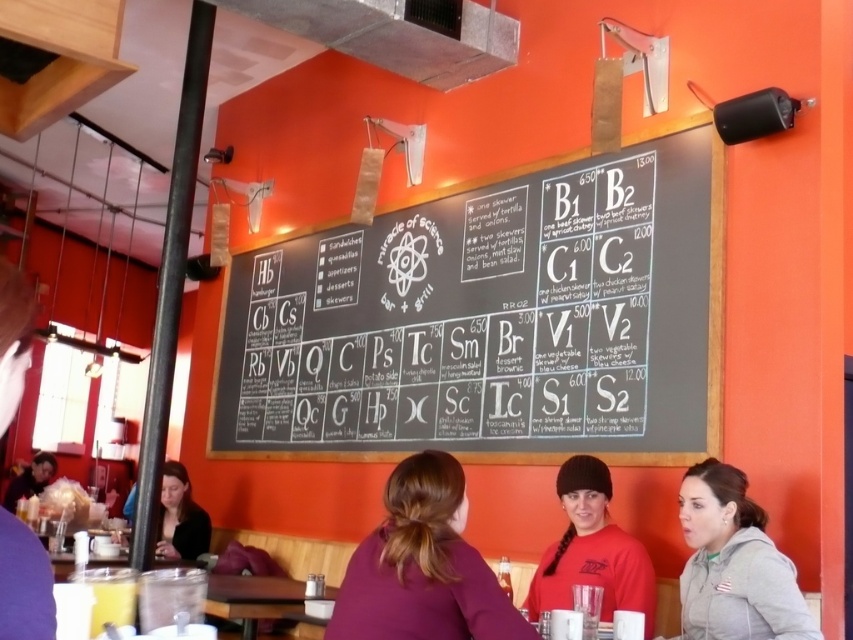
Question: Which point is farther from the camera taking this photo?

Choices:
 (A) (503, 604)
 (B) (729, 481)
 (C) (6, 502)

Answer: (C)

Question: Which point is farther to the camera?

Choices:
 (A) (165, 481)
 (B) (606, 513)

Answer: (A)

Question: Is black chalkboard menu at center above matte black jacket at lower left?

Choices:
 (A) no
 (B) yes

Answer: (B)

Question: Is black chalkboard menu at center positioned before matte black jacket at lower left?

Choices:
 (A) yes
 (B) no

Answer: (A)

Question: Is red matte shirt at center below matte black jacket at lower left?

Choices:
 (A) yes
 (B) no

Answer: (B)

Question: Among these objects, which one is nearest to the camera?

Choices:
 (A) matte black shirt at lower left
 (B) black chalkboard menu at center

Answer: (B)